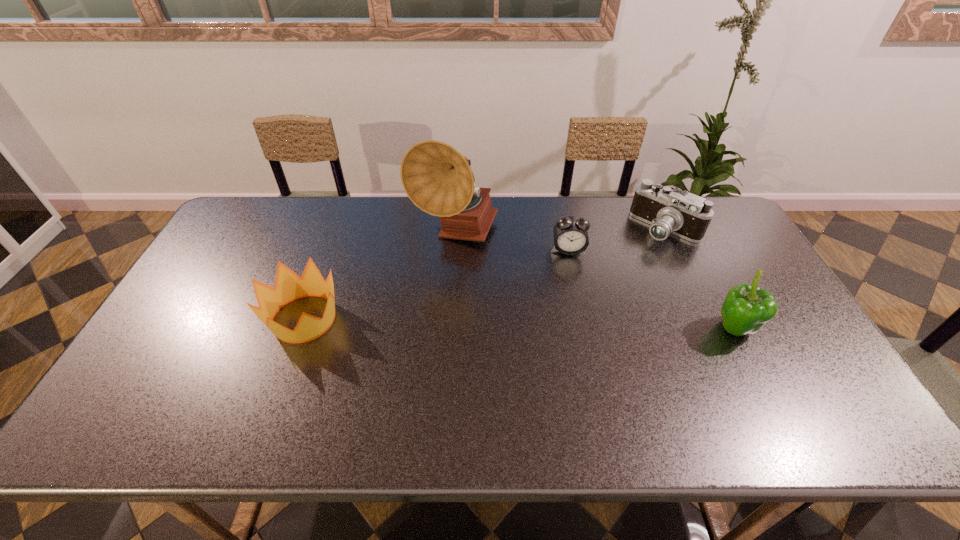
Locate an element on the screen. The width and height of the screenshot is (960, 540). the leftmost object is located at coordinates (289, 286).

Where is `the fourth shortest object`? The width and height of the screenshot is (960, 540). the fourth shortest object is located at coordinates 747,308.

Identify the location of the fourth object from right to left. (435, 176).

Find the location of a particular element. This screenshot has width=960, height=540. the tallest object is located at coordinates (435, 176).

Identify the location of the third object from left to right. (570, 233).

At what (x,y) coordinates should I click in order to perform the action: click on camera. Please return your answer as a coordinate pair (x, y). This screenshot has height=540, width=960. Looking at the image, I should click on (686, 215).

At what (x,y) coordinates should I click in order to perform the action: click on blank space located 0.110m on the left of the crown. Please return your answer as a coordinate pair (x, y). The width and height of the screenshot is (960, 540). Looking at the image, I should click on (226, 319).

I want to click on vacant space situated 0.170m on the left of the second tallest object, so click(x=650, y=329).

Identify the location of vacant region located on the horn of the tallest object. (482, 342).

I want to click on free location located 0.130m on the horn of the tallest object, so click(x=470, y=293).